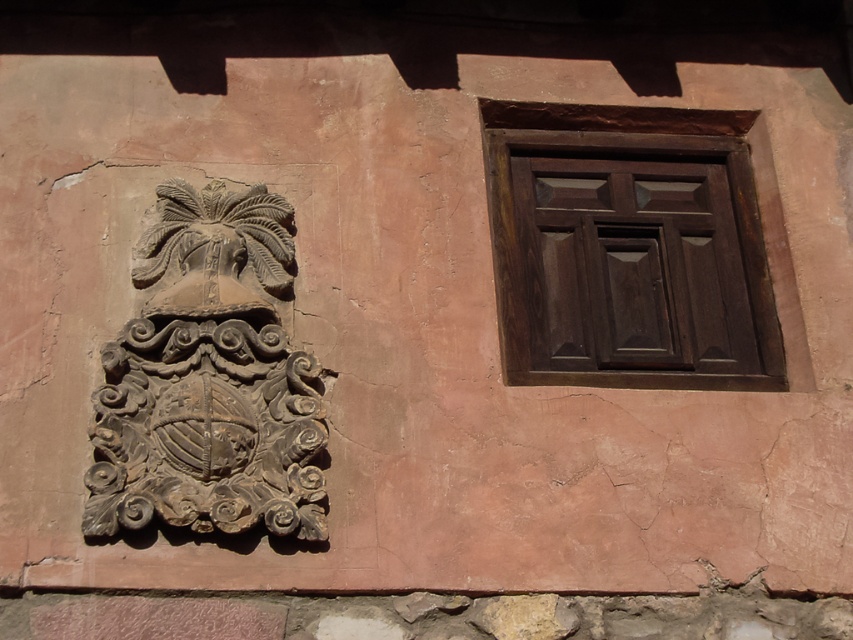
Question: Which point is closer to the camera taking this photo?

Choices:
 (A) (712, 307)
 (B) (193, 500)

Answer: (B)

Question: Which point is closer to the camera taking this photo?

Choices:
 (A) (666, 353)
 (B) (287, 204)

Answer: (B)

Question: Is dark wood window at upper right above dark brown stone crest at left?

Choices:
 (A) no
 (B) yes

Answer: (B)

Question: Does dark wood window at upper right appear on the right side of dark brown stone crest at left?

Choices:
 (A) yes
 (B) no

Answer: (A)

Question: Which object is farther from the camera taking this photo?

Choices:
 (A) dark wood window at upper right
 (B) dark brown stone crest at left

Answer: (A)

Question: Does dark wood window at upper right appear on the left side of dark brown stone crest at left?

Choices:
 (A) no
 (B) yes

Answer: (A)